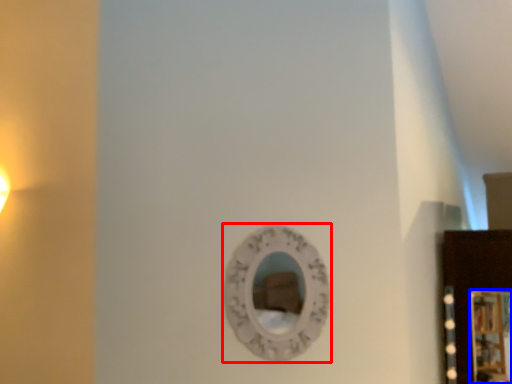
Question: Which object appears farthest to the camera in this image, mirror (highlighted by a red box) or picture frame (highlighted by a blue box)?

Choices:
 (A) mirror
 (B) picture frame

Answer: (B)